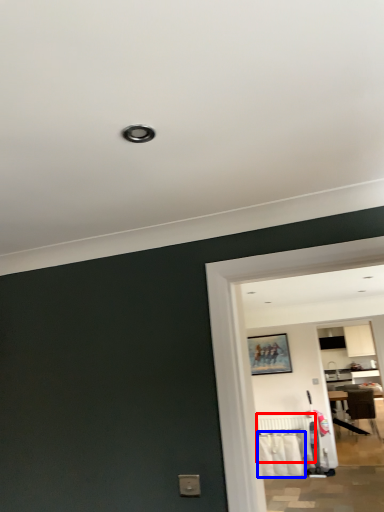
Question: Which object appears closest to the camera in this image, radiator (highlighted by a red box) or laundry (highlighted by a blue box)?

Choices:
 (A) radiator
 (B) laundry

Answer: (B)